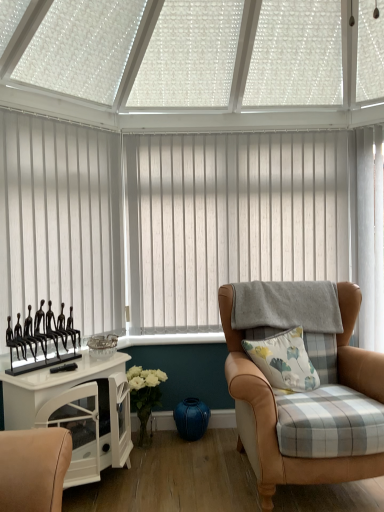
The image size is (384, 512). What do you see at coordinates (60, 222) in the screenshot?
I see `white vertical blinds at left, which is the 2th window blind from back to front` at bounding box center [60, 222].

Identify the location of black metal figurines at left. (41, 340).

Based on the photo, measure the distance between white glossy cabinet at left and camera.

They are 1.89 meters apart.

Where is `leather armchair at right`? The height and width of the screenshot is (512, 384). leather armchair at right is located at coordinates (275, 424).

Can you tell me how much white floral-patterned cushion at center-right and black metal figurines at left differ in facing direction?

31 degrees separate the facing orientations of white floral-patterned cushion at center-right and black metal figurines at left.

Can you confirm if white floral-patterned cushion at center-right is positioned to the left of black metal figurines at left?

No.

Could you tell me if white floral-patterned cushion at center-right is turned towards black metal figurines at left?

No, white floral-patterned cushion at center-right is not facing towards black metal figurines at left.

Can you confirm if white floral-patterned cushion at center-right is bigger than black metal figurines at left?

Yes, white floral-patterned cushion at center-right is bigger than black metal figurines at left.

From the image's perspective, would you say black metal figurines at left is shown under white vertical blinds at center, the 2th window blind positioned from the front?

Yes, from the image's perspective, black metal figurines at left is below white vertical blinds at center, the 2th window blind positioned from the front.

Can you see black metal figurines at left touching white vertical blinds at center, placed as the second window blind when sorted from left to right?

No, black metal figurines at left is not making contact with white vertical blinds at center, placed as the second window blind when sorted from left to right.

Does point (33, 354) come farther from viewer compared to point (329, 218)?

That is False.

Looking at this image, is black metal figurines at left bigger or smaller than white vertical blinds at center, marked as the first window blind in a right-to-left arrangement?

In the image, black metal figurines at left appears to be smaller than white vertical blinds at center, marked as the first window blind in a right-to-left arrangement.

Is white floral-patterned cushion at center-right not inside white vertical blinds at left, arranged as the second window blind when viewed from the right?

Yes.

Where is `the 1st window blind positioned above the white floral-patterned cushion at center-right (from the image's perspective)`? The height and width of the screenshot is (512, 384). the 1st window blind positioned above the white floral-patterned cushion at center-right (from the image's perspective) is located at coordinates (60, 222).

Considering the sizes of objects white floral-patterned cushion at center-right and white vertical blinds at left, which is the 2th window blind from back to front, in the image provided, who is bigger, white floral-patterned cushion at center-right or white vertical blinds at left, which is the 2th window blind from back to front,?

With larger size is white vertical blinds at left, which is the 2th window blind from back to front.

Does white floral-patterned cushion at center-right have a greater height compared to white vertical blinds at left, which is counted as the 1th window blind, starting from the left?

No.

From the image's perspective, relative to white vertical blinds at center, marked as the first window blind in a right-to-left arrangement, is white vertical blinds at left, which is counted as the 1th window blind, starting from the left, above or below?

Clearly, from the image's perspective, white vertical blinds at left, which is counted as the 1th window blind, starting from the left, is below white vertical blinds at center, marked as the first window blind in a right-to-left arrangement.

Does point (93, 256) lie behind point (175, 271)?

No, (93, 256) is in front of (175, 271).

Is white vertical blinds at left, which is counted as the 1th window blind, starting from the left, at the left side of white vertical blinds at center, the 2th window blind positioned from the front?

Indeed, white vertical blinds at left, which is counted as the 1th window blind, starting from the left, is positioned on the left side of white vertical blinds at center, the 2th window blind positioned from the front.

From a real-world perspective, is white vertical blinds at left, which is counted as the 1th window blind, starting from the left, under white vertical blinds at center, placed as the second window blind when sorted from left to right?

No, from a real-world perspective, white vertical blinds at left, which is counted as the 1th window blind, starting from the left, is not under white vertical blinds at center, placed as the second window blind when sorted from left to right.

Considering the sizes of objects white vertical blinds at left, which appears as the first window blind when viewed from the front, and leather armchair at right in the image provided, who is shorter, white vertical blinds at left, which appears as the first window blind when viewed from the front, or leather armchair at right?

Standing shorter between the two is leather armchair at right.

From the image's perspective, does white vertical blinds at left, which appears as the first window blind when viewed from the front, appear higher than leather armchair at right?

Yes, from the image's perspective, white vertical blinds at left, which appears as the first window blind when viewed from the front, is on top of leather armchair at right.

Is white vertical blinds at left, arranged as the second window blind when viewed from the right, to the right of leather armchair at right from the viewer's perspective?

Incorrect, white vertical blinds at left, arranged as the second window blind when viewed from the right, is not on the right side of leather armchair at right.

Is leather armchair at right at the back of white vertical blinds at left, arranged as the second window blind when viewed from the right?

No, leather armchair at right is not at the back of white vertical blinds at left, arranged as the second window blind when viewed from the right.

From the image's perspective, which is below, white glossy cabinet at left or leather armchair at right?

From the image's view, white glossy cabinet at left is below.

Is white glossy cabinet at left shorter than leather armchair at right?

Yes.

This screenshot has width=384, height=512. In order to click on chair above the white glossy cabinet at left (from a real-world perspective) in this screenshot , I will do `click(275, 424)`.

In the scene shown: Does white glossy cabinet at left come behind leather armchair at right?

That is False.

Considering the sizes of black metal figurines at left and white glossy cabinet at left in the image, is black metal figurines at left taller or shorter than white glossy cabinet at left?

Clearly, black metal figurines at left is shorter compared to white glossy cabinet at left.

From the image's perspective, which is above, black metal figurines at left or white glossy cabinet at left?

From the image's view, black metal figurines at left is above.

Is black metal figurines at left oriented away from white glossy cabinet at left?

No.

Considering the relative sizes of black metal figurines at left and white glossy cabinet at left in the image provided, is black metal figurines at left bigger than white glossy cabinet at left?

Incorrect, black metal figurines at left is not larger than white glossy cabinet at left.

Locate an element on the screen. The height and width of the screenshot is (512, 384). pillow below the black metal figurines at left (from a real-world perspective) is located at coordinates (284, 360).

Locate an element on the screen. showcase below the white vertical blinds at center, marked as the first window blind in a right-to-left arrangement (from the image's perspective) is located at coordinates (41, 340).

Estimate the real-world distances between objects in this image. Which object is closer to leather armchair at right, white vertical blinds at left, arranged as the second window blind when viewed from the right, or white floral-patterned cushion at center-right?

Among the two, white floral-patterned cushion at center-right is located nearer to leather armchair at right.

Based on their spatial positions, is white glossy cabinet at left or white vertical blinds at left, which appears as the first window blind when viewed from the front, closer to leather armchair at right?

white glossy cabinet at left is positioned closer to the anchor leather armchair at right.

Considering their positions, is black metal figurines at left positioned further to white floral-patterned cushion at center-right than leather armchair at right?

black metal figurines at left is further to white floral-patterned cushion at center-right.

Looking at the image, which one is located further to white vertical blinds at left, which is counted as the 1th window blind, starting from the left, white vertical blinds at center, the 2th window blind positioned from the front, or black metal figurines at left?

The object further to white vertical blinds at left, which is counted as the 1th window blind, starting from the left, is white vertical blinds at center, the 2th window blind positioned from the front.

Looking at the image, which one is located further to white floral-patterned cushion at center-right, white glossy cabinet at left or white vertical blinds at left, which appears as the first window blind when viewed from the front?

Among the two, white vertical blinds at left, which appears as the first window blind when viewed from the front, is located further to white floral-patterned cushion at center-right.

Based on their spatial positions, is white floral-patterned cushion at center-right or white vertical blinds at left, which is counted as the 1th window blind, starting from the left, further from leather armchair at right?

white vertical blinds at left, which is counted as the 1th window blind, starting from the left, is further to leather armchair at right.

Considering their positions, is white floral-patterned cushion at center-right positioned closer to white vertical blinds at center, placed as the second window blind when sorted from left to right, than white vertical blinds at left, arranged as the second window blind when viewed from the right?

white vertical blinds at left, arranged as the second window blind when viewed from the right.

Estimate the real-world distances between objects in this image. Which object is further from black metal figurines at left, white floral-patterned cushion at center-right or white vertical blinds at center, placed as the second window blind when sorted from left to right?

The object further to black metal figurines at left is white vertical blinds at center, placed as the second window blind when sorted from left to right.

At what (x,y) coordinates should I click in order to perform the action: click on pillow between leather armchair at right and white vertical blinds at center, marked as the first window blind in a right-to-left arrangement, in the front-back direction. Please return your answer as a coordinate pair (x, y). This screenshot has width=384, height=512. Looking at the image, I should click on (284, 360).

Find the location of a particular element. showcase between white vertical blinds at left, which is the 2th window blind from back to front, and white floral-patterned cushion at center-right is located at coordinates (41, 340).

This screenshot has width=384, height=512. Identify the location of window blind between white glossy cabinet at left and white floral-patterned cushion at center-right. (230, 218).

I want to click on showcase situated between white vertical blinds at left, which is the 2th window blind from back to front, and leather armchair at right from left to right, so click(x=41, y=340).